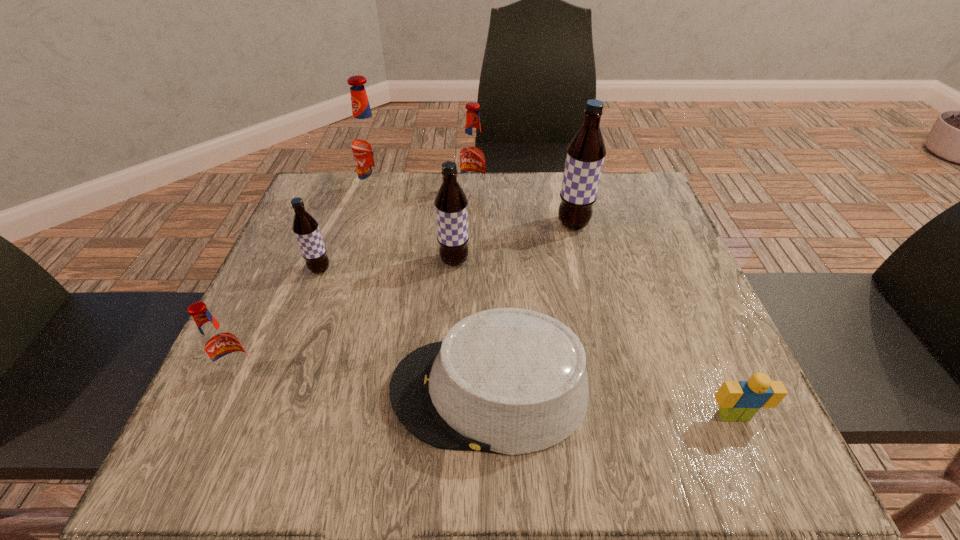
The image size is (960, 540). Find the location of `empty space between the nearest root beer and the fourth nearest root beer`. empty space between the nearest root beer and the fourth nearest root beer is located at coordinates (407, 300).

Find the location of `vacant point located between the rightmost root beer and the hat`. vacant point located between the rightmost root beer and the hat is located at coordinates (531, 308).

Identify the location of vacant region between the second brown root beer from left to right and the second object from left to right. Image resolution: width=960 pixels, height=540 pixels. (387, 265).

Identify which object is the seventh nearest to the fourth root beer from right to left. Please provide its 2D coordinates. Your answer should be formatted as a tuple, i.e. [(x, y)], where the tuple contains the x and y coordinates of a point satisfying the conditions above.

[(739, 401)]

Locate an element on the screen. The width and height of the screenshot is (960, 540). object that stands as the fifth closest to the biggest red root beer is located at coordinates (510, 381).

Where is `root beer identified as the closest to the Lego`? This screenshot has height=540, width=960. root beer identified as the closest to the Lego is located at coordinates (586, 152).

You are a GUI agent. You are given a task and a screenshot of the screen. Output one action in this format:
    pyautogui.click(x=<x>, y=<y>)
    Task: Click on the third closest root beer to the farthest brown root beer
    This screenshot has height=540, width=960.
    Given the screenshot: What is the action you would take?
    pyautogui.click(x=368, y=142)

Identify which red root beer is the closest to the hat. Please provide its 2D coordinates. Your answer should be formatted as a tuple, i.e. [(x, y)], where the tuple contains the x and y coordinates of a point satisfying the conditions above.

[(222, 347)]

Identify which red root beer is the second nearest to the third object from left to right. Please provide its 2D coordinates. Your answer should be formatted as a tuple, i.e. [(x, y)], where the tuple contains the x and y coordinates of a point satisfying the conditions above.

[(222, 347)]

Select which brown root beer appears as the second closest to the second brown root beer from left to right. Please provide its 2D coordinates. Your answer should be formatted as a tuple, i.e. [(x, y)], where the tuple contains the x and y coordinates of a point satisfying the conditions above.

[(305, 227)]